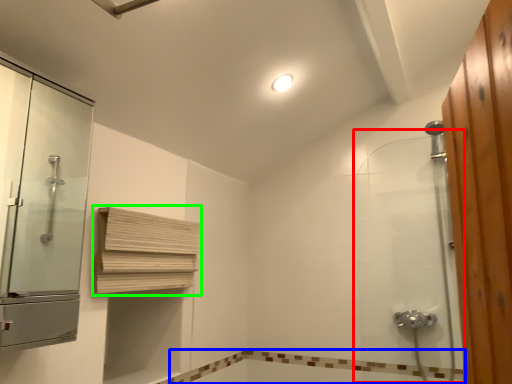
Question: Which object is the closest to the shower door (highlighted by a red box)? Choose among these: bath (highlighted by a blue box) or shelf (highlighted by a green box).

Choices:
 (A) bath
 (B) shelf

Answer: (A)